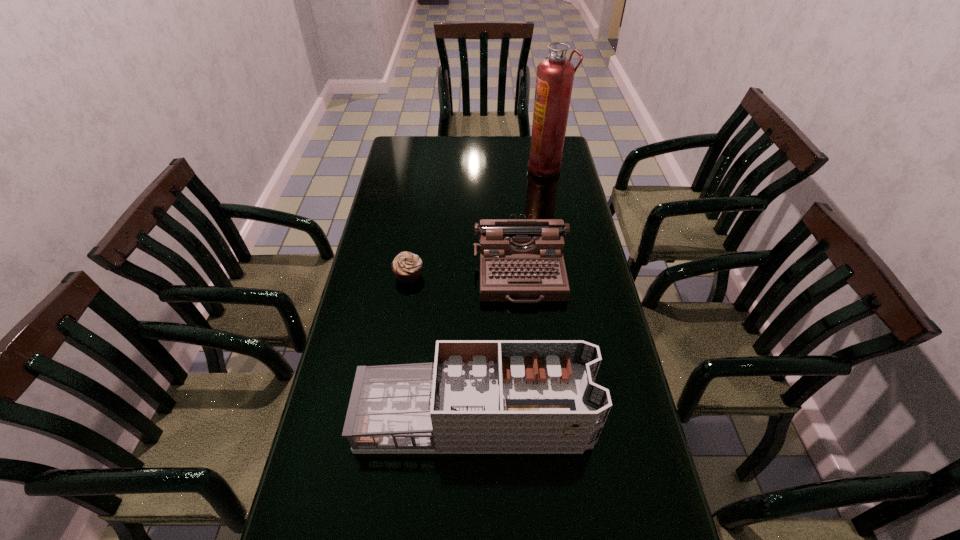
Where is `vacant space located on the front of the shortest object`? This screenshot has width=960, height=540. vacant space located on the front of the shortest object is located at coordinates (389, 400).

Where is `object positioned at the far edge`? The image size is (960, 540). object positioned at the far edge is located at coordinates (554, 81).

Image resolution: width=960 pixels, height=540 pixels. I want to click on dollhouse located at the left edge, so click(x=479, y=396).

At what (x,y) coordinates should I click in order to perform the action: click on muffin that is at the left edge. Please return your answer as a coordinate pair (x, y). The image size is (960, 540). Looking at the image, I should click on (407, 266).

At what (x,y) coordinates should I click in order to perform the action: click on fire extinguisher at the right edge. Please return your answer as a coordinate pair (x, y). Looking at the image, I should click on (554, 81).

The width and height of the screenshot is (960, 540). In order to click on dollhouse situated at the right edge in this screenshot , I will do `click(479, 396)`.

The image size is (960, 540). Find the location of `typewriter that is positioned at the right edge`. typewriter that is positioned at the right edge is located at coordinates (521, 260).

Image resolution: width=960 pixels, height=540 pixels. Find the location of `object located at the far right corner`. object located at the far right corner is located at coordinates (554, 81).

The height and width of the screenshot is (540, 960). I want to click on vacant region at the far edge of the desktop, so click(504, 161).

Where is `free point at the left edge`? This screenshot has height=540, width=960. free point at the left edge is located at coordinates (358, 513).